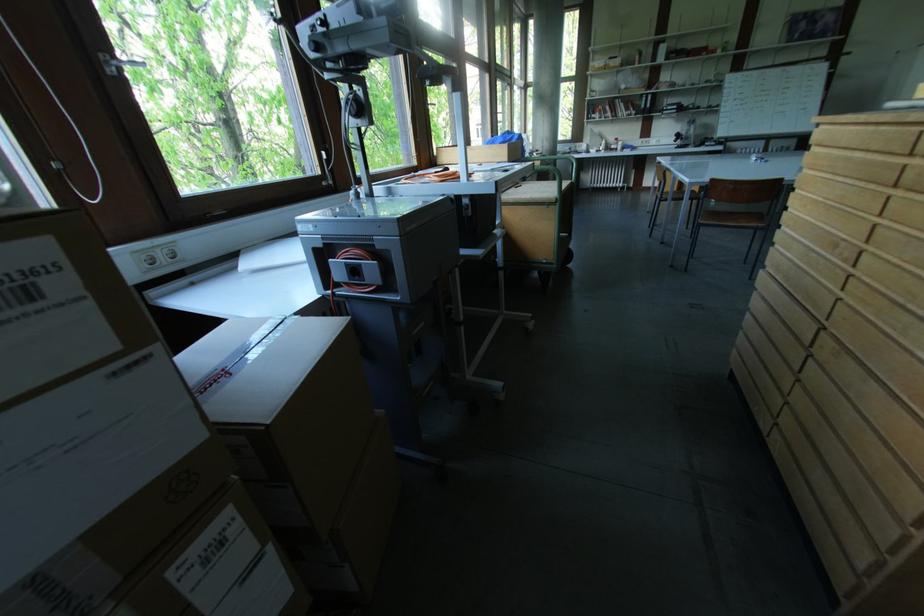
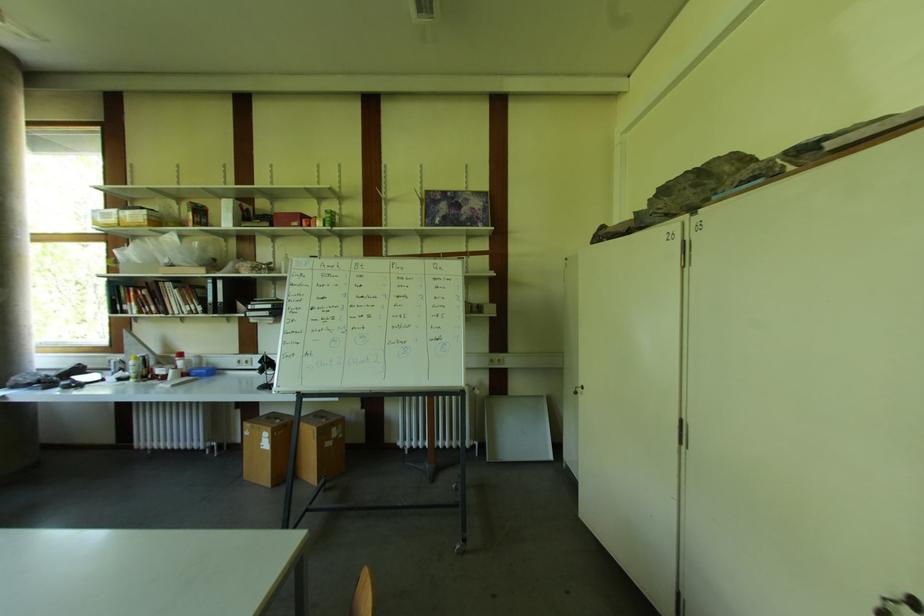
In the second image, find the point that corresponds to (x=708, y=55) in the first image.

(298, 225)